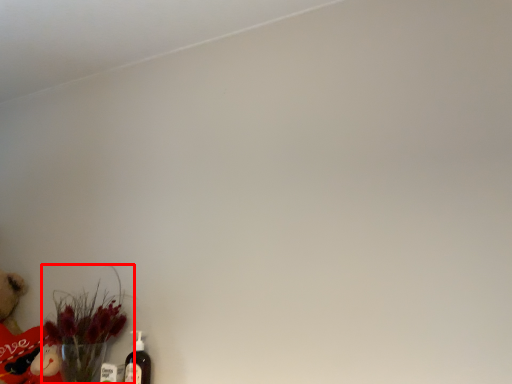
Question: From the image's perspective, where is floral arrangement (annotated by the red box) located relative to bottle?

Choices:
 (A) below
 (B) above

Answer: (B)